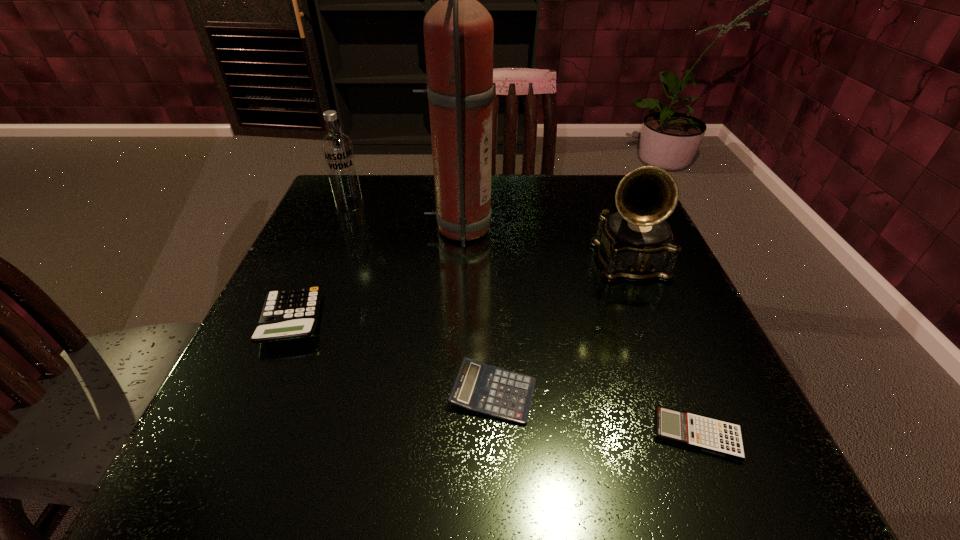
The height and width of the screenshot is (540, 960). Identify the location of free space between the leftmost calculator and the phonograph record. (460, 291).

Image resolution: width=960 pixels, height=540 pixels. Find the location of `vacant area that lies between the tallest object and the leftmost calculator`. vacant area that lies between the tallest object and the leftmost calculator is located at coordinates (375, 274).

Find the location of `empty location between the fire extinguisher and the vodka`. empty location between the fire extinguisher and the vodka is located at coordinates (404, 217).

The width and height of the screenshot is (960, 540). I want to click on free space between the second shortest calculator and the tallest object, so click(476, 311).

The height and width of the screenshot is (540, 960). Find the location of `vacant space in between the vodka and the leftmost calculator`. vacant space in between the vodka and the leftmost calculator is located at coordinates (321, 262).

At what (x,y) coordinates should I click in order to perform the action: click on free area in between the shortest calculator and the tallest object. Please return your answer as a coordinate pair (x, y). This screenshot has width=960, height=540. Looking at the image, I should click on (577, 332).

Locate an element on the screen. The width and height of the screenshot is (960, 540). vacant region between the vodka and the phonograph record is located at coordinates (489, 233).

The width and height of the screenshot is (960, 540). In order to click on free point between the fifth tallest object and the vodka in this screenshot , I will do `click(421, 299)`.

What are the coordinates of `free area in between the second tallest calculator and the leftmost calculator` in the screenshot? It's located at (393, 356).

Image resolution: width=960 pixels, height=540 pixels. I want to click on free space that is in between the shortest object and the second tallest calculator, so click(x=595, y=414).